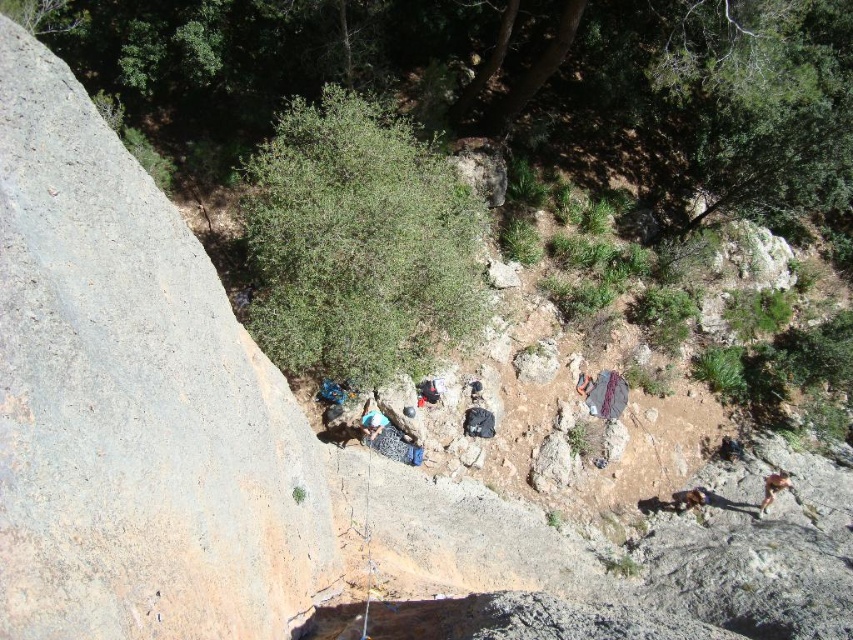
You are standing at point (x=379, y=432) and want to move to the large smooth rock face on the left side. Is the point (x=106, y=476) between you and the rock face?

Yes, point (x=106, y=476) is between you and the rock face because it is in front of point (x=379, y=432), which is your current position.

You are planning to set up a tent in the clearing. The gray rough rock at left is blocking the path to the camouflage fabric bag at center. Can you move the rock to access the bag?

The gray rough rock at left is in front of the camouflage fabric bag at center, so moving the rock would allow access to the bag.

You are planning to set up a tent in the clearing. The gray rough rock at left is an obstacle. Can you place the tent near the camouflage fabric bag at center without the rock blocking the view?

The gray rough rock at left is not as tall as the camouflage fabric bag at center, so the rock might not block the view of the camouflage fabric bag at center. However, since the rock is in the foreground on the left, it could still block the view depending on the exact placement of the tent. The height difference alone doesn